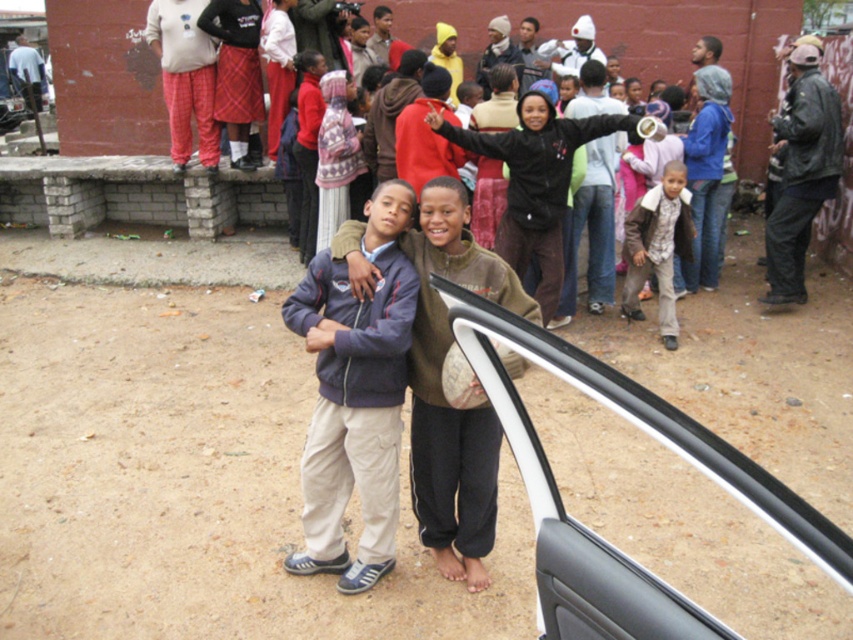
Can you confirm if camouflage jacket at center is positioned to the left of plaid skirt at upper center?

Incorrect, camouflage jacket at center is not on the left side of plaid skirt at upper center.

Is point (689, 204) positioned before point (221, 120)?

Yes, point (689, 204) is in front of point (221, 120).

Locate an element on the screen. Image resolution: width=853 pixels, height=640 pixels. camouflage jacket at center is located at coordinates (659, 246).

Can you confirm if brown fuzzy sweater at center is positioned to the left of plaid skirt at upper center?

In fact, brown fuzzy sweater at center is to the right of plaid skirt at upper center.

This screenshot has height=640, width=853. I want to click on brown fuzzy sweater at center, so click(537, 180).

Where is `brown fuzzy sweater at center`? The image size is (853, 640). brown fuzzy sweater at center is located at coordinates (537, 180).

Is the position of brown fuzzy sweater at center less distant than that of camouflage jacket at center?

That is True.

Is the position of brown fuzzy sweater at center more distant than that of camouflage jacket at center?

No, brown fuzzy sweater at center is in front of camouflage jacket at center.

Does point (582, 129) come in front of point (627, 253)?

Yes, point (582, 129) is closer to viewer.

Find the location of a particular element. This screenshot has height=640, width=853. brown fuzzy sweater at center is located at coordinates (537, 180).